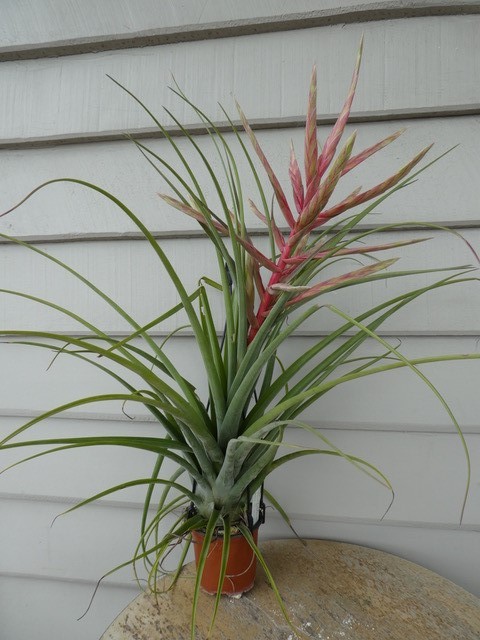
Find the location of a particular element. The height and width of the screenshot is (640, 480). pot is located at coordinates 230,556.